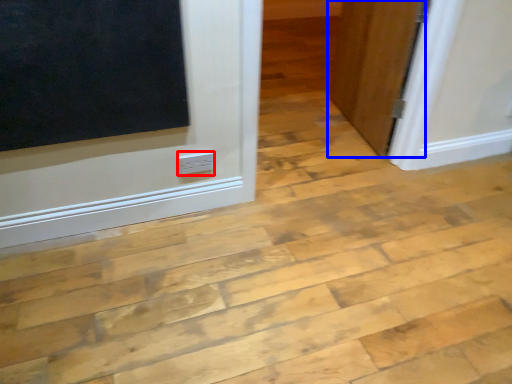
Question: Which of the following is the farthest to the observer, electric outlet (highlighted by a red box) or door (highlighted by a blue box)?

Choices:
 (A) electric outlet
 (B) door

Answer: (B)